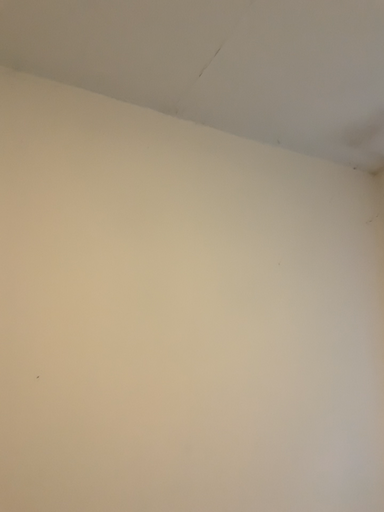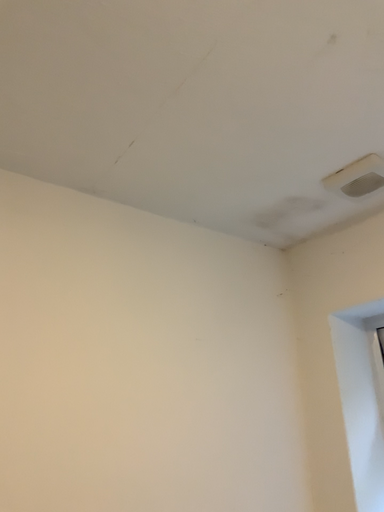
Question: Which way did the camera rotate in the video?

Choices:
 (A) rotated downward
 (B) rotated upward

Answer: (B)